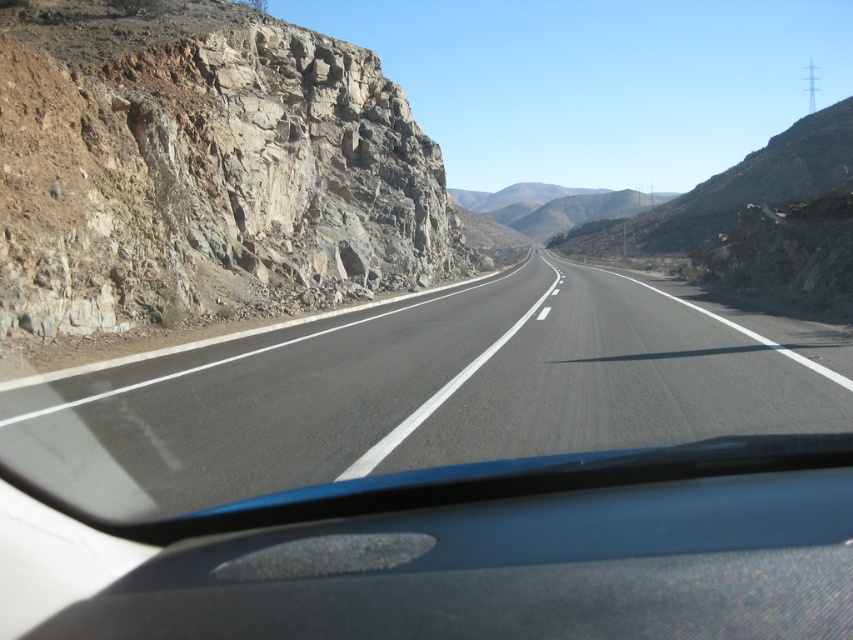
You are sitting in the front passenger seat of the vehicle and notice two points marked on the road ahead. The first point is at coordinates point (228, 58) and the second is at point (541, 300). Which point is closer to your current position?

Point (228, 58) is closer to your current position because it is further to the viewer than point (541, 300), meaning it is nearer to the vehicle.

You are driving a car and want to know if the rocky cliff at left is closer to you than the black asphalt road at center. Based on the scene, can you determine which one is closer?

The rocky cliff at left is further to the viewer than the black asphalt road at center, so the black asphalt road at center is closer to you.

You are driving a car and want to know if there is enough space to safely pull over to the side of the road. Considering the rocky cliff at left and the black asphalt road at center, which side has more space for parking?

The rocky cliff at left has a larger width than the black asphalt road at center, so there is more space available on the left side for parking.